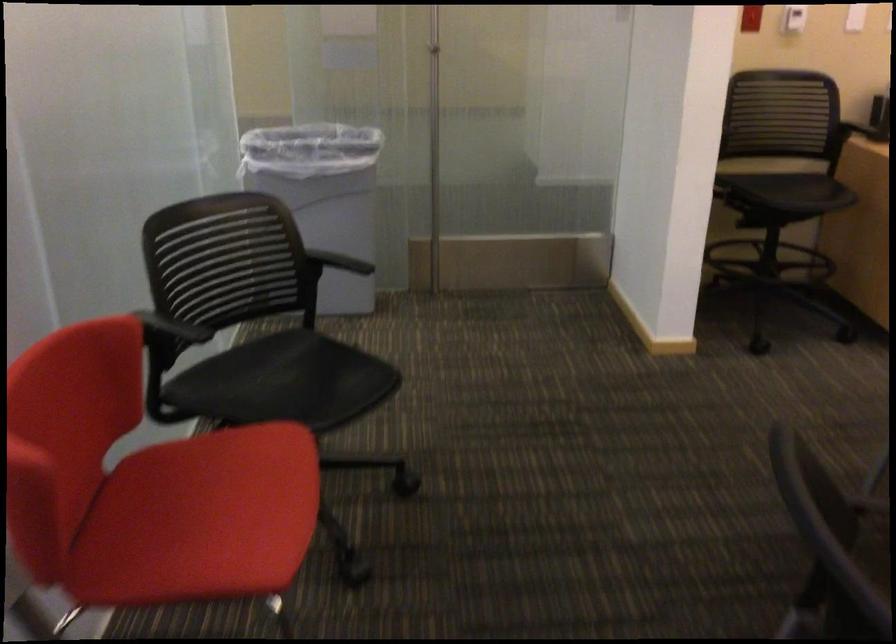
The image size is (896, 644). What do you see at coordinates (200, 518) in the screenshot? I see `a red chair sitting surface` at bounding box center [200, 518].